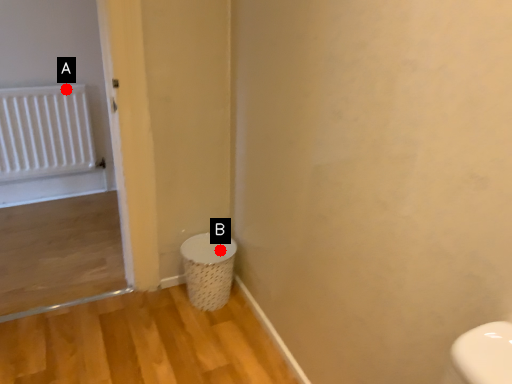
Question: Two points are circled on the image, labeled by A and B beside each circle. Which of the following is the farthest from the observer?

Choices:
 (A) A is further
 (B) B is further

Answer: (A)